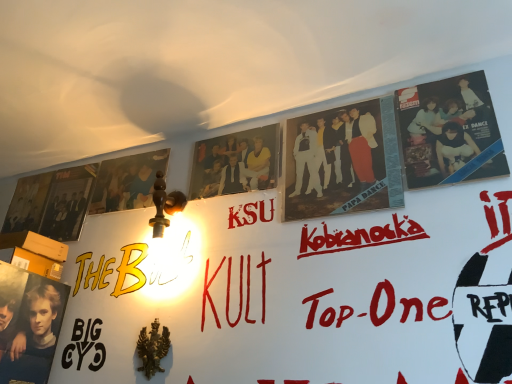
Question: Is matte black album cover at left, which is the second poster from right to left, surrounded by matte black album at upper right, the 1th person when ordered from right to left?

Choices:
 (A) yes
 (B) no

Answer: (B)

Question: Is matte black album at upper right, the 1th person when ordered from right to left, in front of matte black album cover at left, which is the second poster from right to left?

Choices:
 (A) no
 (B) yes

Answer: (B)

Question: Is matte black album at upper right, the 4th person positioned from the left, at the left side of matte black album cover at left, which is the second poster from right to left?

Choices:
 (A) no
 (B) yes

Answer: (A)

Question: Is matte black album at upper right, the 4th person positioned from the left, next to matte black album cover at left, positioned as the 1th poster in left-to-right order, and touching it?

Choices:
 (A) no
 (B) yes

Answer: (A)

Question: Is matte black album at upper right, the 1th person when ordered from right to left, completely or partially outside of matte black album cover at left, positioned as the 1th poster in left-to-right order?

Choices:
 (A) no
 (B) yes

Answer: (B)

Question: Does matte black poster at upper left, which ranks as the 2th poster in left-to-right order, have a lesser height compared to matte black poster at lower left, which ranks as the first person in left-to-right order?

Choices:
 (A) yes
 (B) no

Answer: (A)

Question: From the image's perspective, is matte black poster at upper left, which ranks as the 2th poster in left-to-right order, below matte black poster at lower left, the fourth person from the right?

Choices:
 (A) yes
 (B) no

Answer: (B)

Question: Can you confirm if matte black poster at upper left, marked as the first poster in a right-to-left arrangement, is positioned to the right of matte black poster at lower left, which ranks as the first person in left-to-right order?

Choices:
 (A) yes
 (B) no

Answer: (A)

Question: From the image's perspective, is matte black poster at upper left, which ranks as the 2th poster in left-to-right order, on top of matte black poster at lower left, which ranks as the first person in left-to-right order?

Choices:
 (A) no
 (B) yes

Answer: (B)

Question: Is matte black poster at upper left, marked as the first poster in a right-to-left arrangement, in contact with matte black poster at lower left, the fourth person from the right?

Choices:
 (A) no
 (B) yes

Answer: (A)

Question: Is the depth of matte black poster at upper left, which ranks as the 2th poster in left-to-right order, greater than that of matte black poster at lower left, which ranks as the first person in left-to-right order?

Choices:
 (A) yes
 (B) no

Answer: (A)

Question: Considering the relative sizes of matte black album cover at left, positioned as the 1th poster in left-to-right order, and matte black poster at lower left, the fourth person from the right, in the image provided, is matte black album cover at left, positioned as the 1th poster in left-to-right order, shorter than matte black poster at lower left, the fourth person from the right,?

Choices:
 (A) no
 (B) yes

Answer: (B)